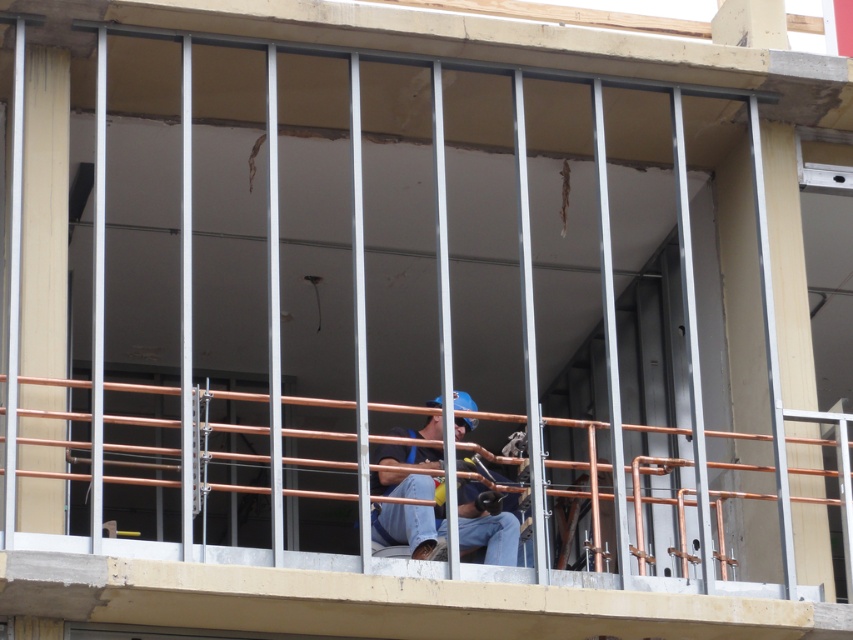
Question: Which object appears closest to the camera in this image?

Choices:
 (A) copper pipe railing at center
 (B) blue hard hat at center

Answer: (A)

Question: Is the position of copper pipe railing at center more distant than that of blue hard hat at center?

Choices:
 (A) yes
 (B) no

Answer: (B)

Question: Is copper pipe railing at center bigger than blue hard hat at center?

Choices:
 (A) yes
 (B) no

Answer: (A)

Question: Is copper pipe railing at center above blue hard hat at center?

Choices:
 (A) no
 (B) yes

Answer: (A)

Question: Which of the following is the farthest from the observer?

Choices:
 (A) blue hard hat at center
 (B) copper pipe railing at center

Answer: (A)